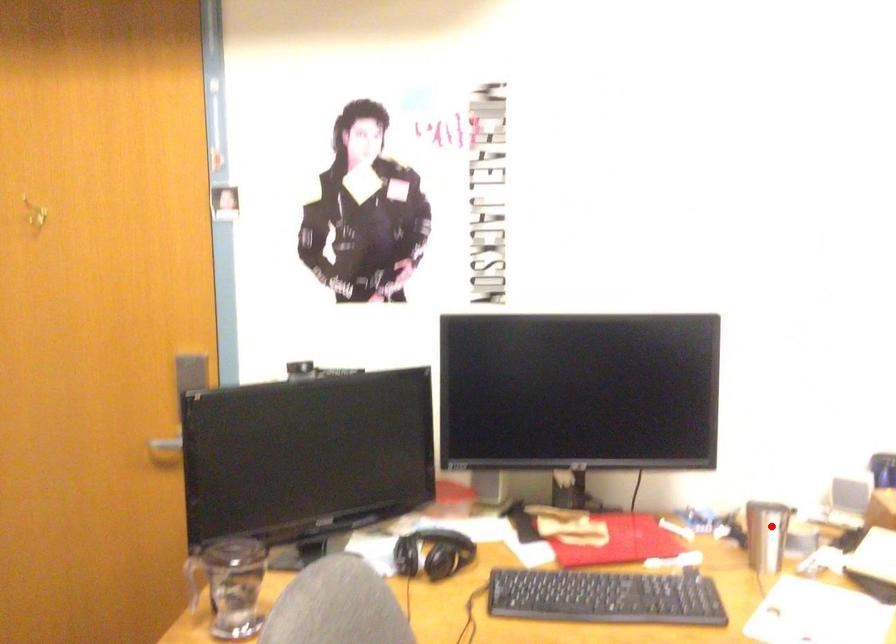
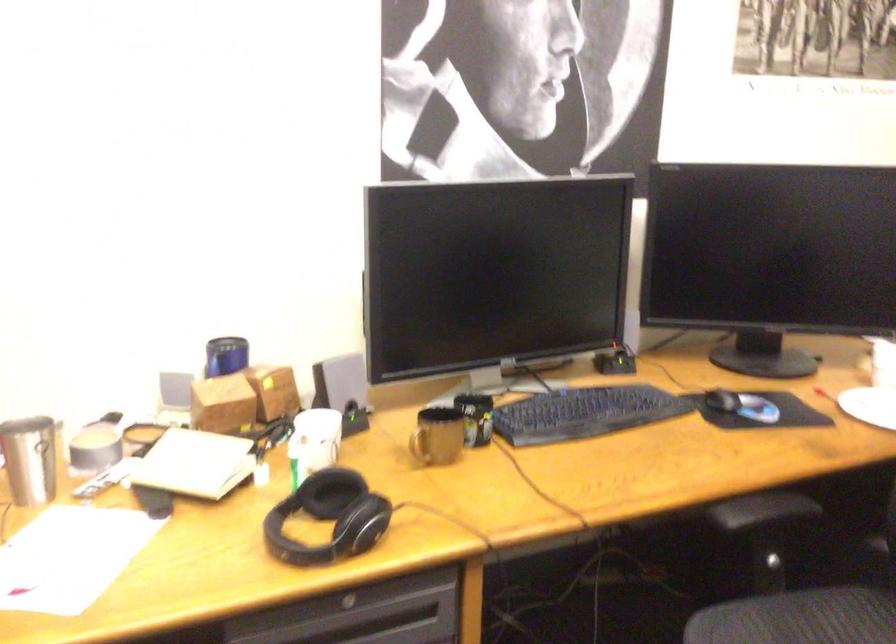
Question: I am providing you with two images of the same scene from different viewpoints. In image1, a red point is highlighted. Considering the same 3D point in image2, which of the following is correct?

Choices:
 (A) It is closer
 (B) It is farther

Answer: (A)